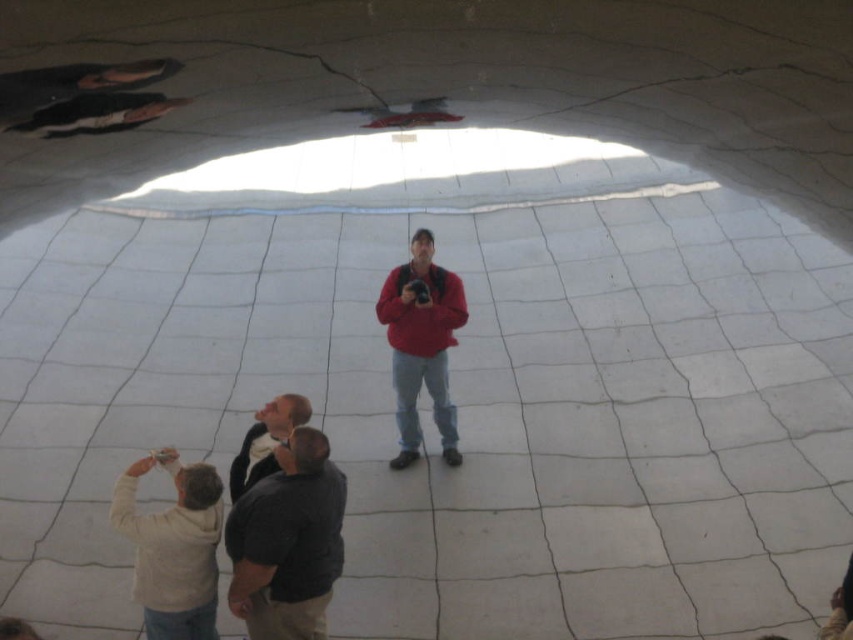
You are standing in the dome structure and want to take a photo of the light coming through the ceiling opening. The person in the matte red jacket at center is blocking your view. Can you move around the dark gray sweater at lower center to get a clear shot?

The matte red jacket at center is located above the dark gray sweater at lower center, so moving around the dark gray sweater at lower center might allow you to see under or around the person in the matte red jacket at center for a clearer shot.

You are standing in the dome structure and notice the matte red jacket at center and the dark gray sweater at lower center. Which object appears larger to you?

The matte red jacket at center appears larger than the dark gray sweater at lower center.

You are standing at point [280,608] and want to walk to point [442,312]. Is there a clear path between these two points without any obstacles?

Yes, there is a clear path between point [280,608] and point [442,312] because the first point is in front of the second point, indicating no obstacles blocking the way.